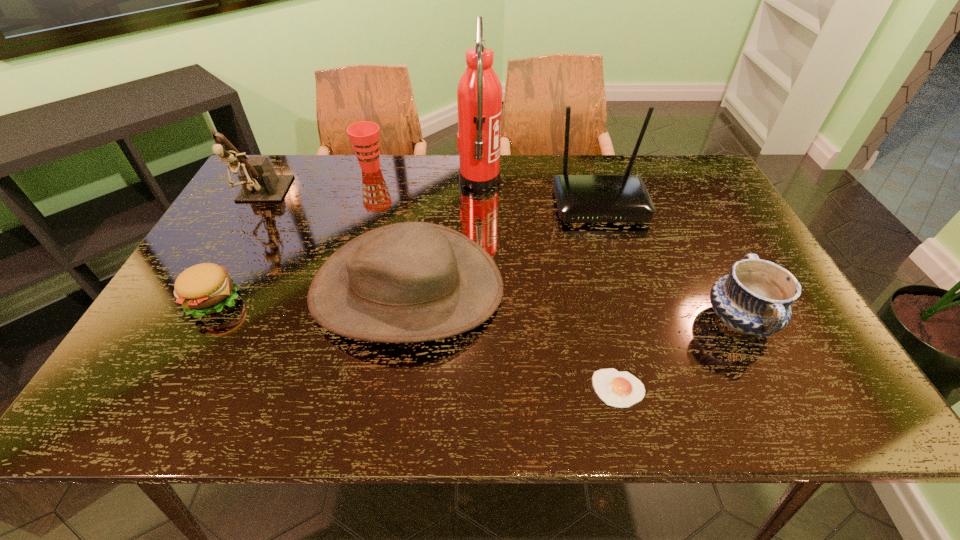
You are a GUI agent. You are given a task and a screenshot of the screen. Output one action in this format:
    pyautogui.click(x=<x>, y=<y>)
    Task: Click on the free space at the near left corner of the desktop
    
    Given the screenshot: What is the action you would take?
    pyautogui.click(x=108, y=416)

The image size is (960, 540). In the image, there is a desktop. In order to click on free space at the far right corner in this screenshot , I will do `click(673, 167)`.

You are a GUI agent. You are given a task and a screenshot of the screen. Output one action in this format:
    pyautogui.click(x=<x>, y=<y>)
    Task: Click on the vacant point located between the figurine and the seventh tallest object
    
    Given the screenshot: What is the action you would take?
    pyautogui.click(x=237, y=249)

At what (x,y) coordinates should I click in order to perform the action: click on empty space that is in between the router and the shortest object. Please return your answer as a coordinate pair (x, y). Image resolution: width=960 pixels, height=540 pixels. Looking at the image, I should click on (609, 296).

At what (x,y) coordinates should I click in order to perform the action: click on free space between the cup and the second shortest object. Please return your answer as a coordinate pair (x, y). The image size is (960, 540). Looking at the image, I should click on (293, 234).

The image size is (960, 540). I want to click on empty space that is in between the hamburger and the figurine, so click(x=237, y=249).

Find the location of a particular element. This screenshot has width=960, height=540. vacant area between the tallest object and the nearest object is located at coordinates (549, 285).

You are a GUI agent. You are given a task and a screenshot of the screen. Output one action in this format:
    pyautogui.click(x=<x>, y=<y>)
    Task: Click on the unoccupied position between the pottery and the tallest object
    
    Given the screenshot: What is the action you would take?
    pyautogui.click(x=610, y=250)

Select which object is the fifth closest to the hamburger. Please provide its 2D coordinates. Your answer should be formatted as a tuple, i.e. [(x, y)], where the tuple contains the x and y coordinates of a point satisfying the conditions above.

[(618, 389)]

You are a GUI agent. You are given a task and a screenshot of the screen. Output one action in this format:
    pyautogui.click(x=<x>, y=<y>)
    Task: Click on the object that can be found as the third closest to the cowboy hat
    The image size is (960, 540).
    Given the screenshot: What is the action you would take?
    pyautogui.click(x=618, y=389)